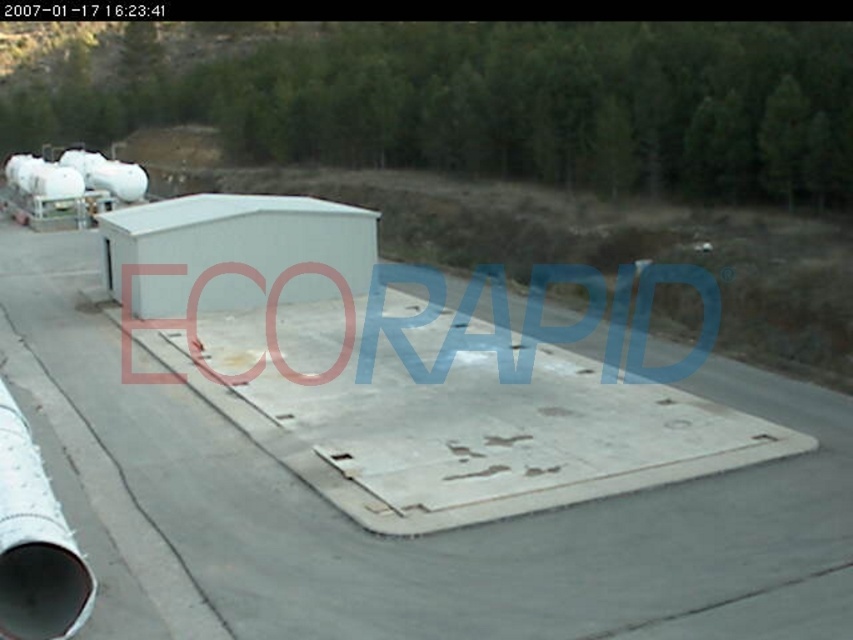
You are a delivery driver who needs to unload heavy machinery onto the gray concrete tarmac at center and the rusty metal ramp at center. Which surface should you choose to ensure the machinery remains stable?

The gray concrete tarmac at center is positioned over the rusty metal ramp at center, so the gray concrete tarmac at center is more stable and level for unloading heavy machinery.

You are a maintenance worker needing to access the gray concrete tarmac at center. There is a white metallic pipe at lower left blocking your path. Can you step over the pipe to reach the tarmac?

The gray concrete tarmac at center is much taller than the white metallic pipe at lower left, so you can step over the pipe to reach the tarmac.

You are a delivery driver who needs to unload a heavy crate onto the rusty metal ramp at center. However, you notice a white metallic pipe at lower left nearby. Based on the scene, which object is positioned to the right of the other?

The rusty metal ramp at center is positioned to the right of the white metallic pipe at lower left.